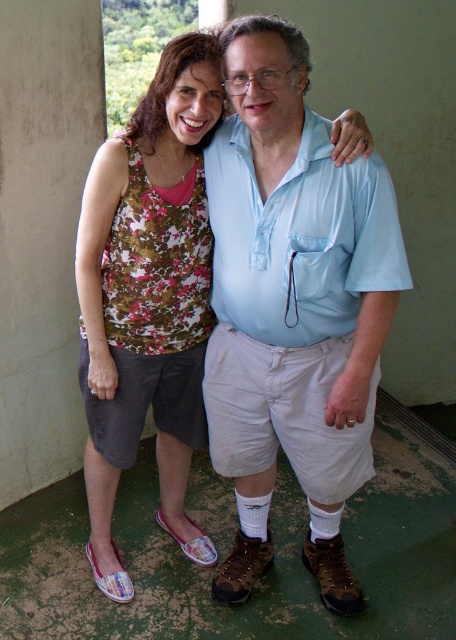
You are a photographer trying to capture a group photo of the light blue cotton shirt at center and the floral fabric tank top at center. If you want to ensure both are in focus, which one should you adjust the camera focus to prioritize?

The light blue cotton shirt at center is smaller than the floral fabric tank top at center, so you should prioritize focusing on the light blue cotton shirt at center to ensure both are in focus.

You are a photographer setting up a shoot in this scene. You need to ensure that the light blue cotton shirt at center is visible above the floral fabric tank top at center for the photo. Is this possible with their current positions?

The light blue cotton shirt at center is located below the floral fabric tank top at center, so it cannot be visible above it in their current positions.